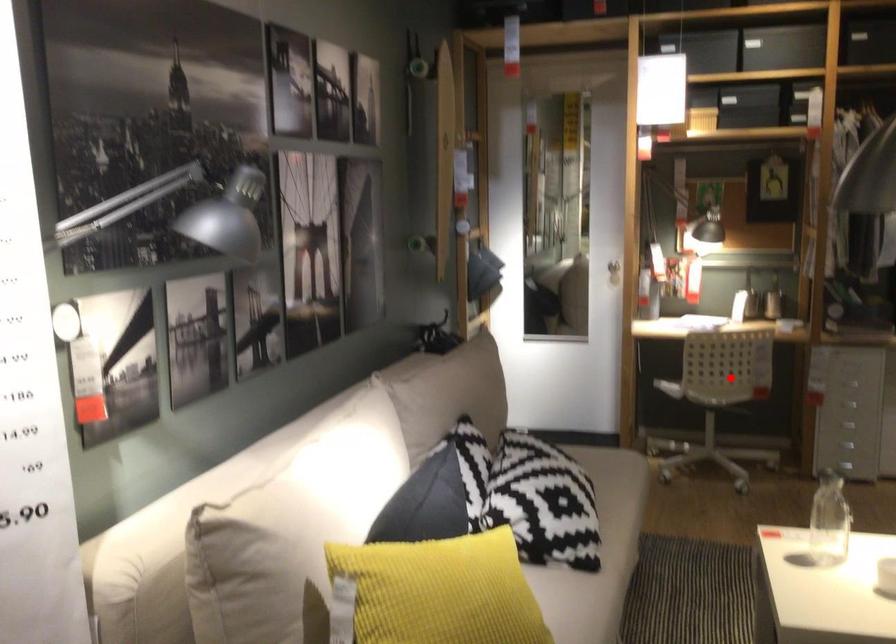
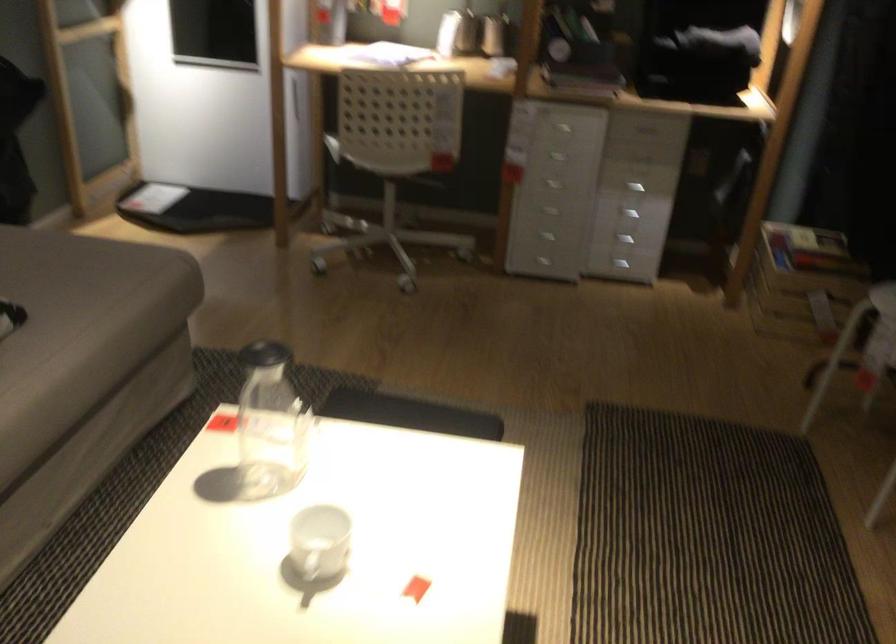
The point at the highlighted location is marked in the first image. Where is the corresponding point in the second image?

(388, 158)